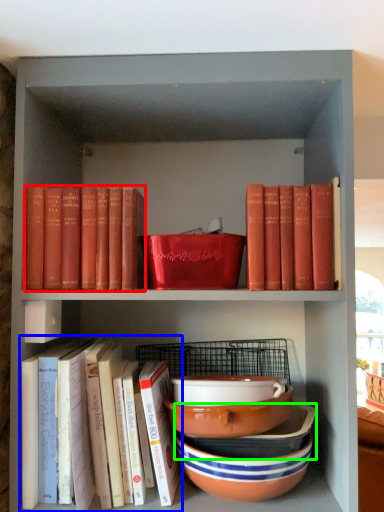
Question: Which object is the farthest from book (highlighted by a red box)? Choose among these: book (highlighted by a blue box) or bowl (highlighted by a green box).

Choices:
 (A) book
 (B) bowl

Answer: (B)